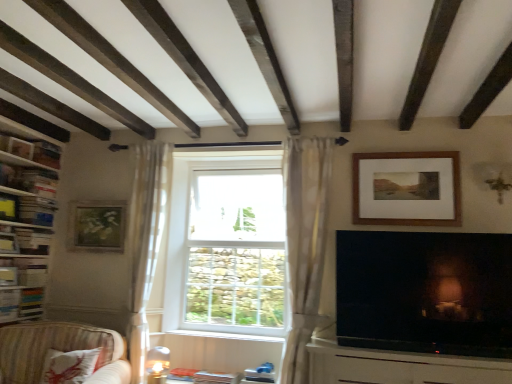
Locate an element on the screen. The width and height of the screenshot is (512, 384). white sheer curtain at left, the 2th curtain positioned from the right is located at coordinates (146, 241).

The height and width of the screenshot is (384, 512). What do you see at coordinates (97, 226) in the screenshot?
I see `matte gold picture frame at left, arranged as the second picture frame when viewed from the right` at bounding box center [97, 226].

What is the approximate width of white glass window at center?

The width of white glass window at center is 24.80 centimeters.

Describe the element at coordinates (26, 218) in the screenshot. I see `wooden bookshelf at left, acting as the 2th shelf starting from the bottom` at that location.

This screenshot has width=512, height=384. What are the coordinates of `white sheer curtain at left, the 2th curtain positioned from the right` in the screenshot? It's located at click(x=146, y=241).

Is wooden bookshelf at left, placed as the 1th shelf when sorted from bottom to top, facing away from wooden bookshelf at left, acting as the 2th shelf starting from the bottom?

Yes.

You are a GUI agent. You are given a task and a screenshot of the screen. Output one action in this format:
    pyautogui.click(x=<x>, y=<y>)
    Task: Click on the shelf to the right of wooden bookshelf at left, acting as the 2th shelf starting from the bottom
    
    Given the screenshot: What is the action you would take?
    pyautogui.click(x=24, y=240)

From their relative heights in the image, would you say wooden bookshelf at left, which is the 2th shelf from top to bottom, is taller or shorter than wooden bookshelf at left, acting as the 2th shelf starting from the bottom?

Clearly, wooden bookshelf at left, which is the 2th shelf from top to bottom, is shorter compared to wooden bookshelf at left, acting as the 2th shelf starting from the bottom.

Considering the positions of objects wooden bookshelf at left, placed as the 1th shelf when sorted from bottom to top, and wooden bookshelf at left, acting as the 2th shelf starting from the bottom, in the image provided, who is more to the left, wooden bookshelf at left, placed as the 1th shelf when sorted from bottom to top, or wooden bookshelf at left, acting as the 2th shelf starting from the bottom,?

From the viewer's perspective, wooden bookshelf at left, acting as the 2th shelf starting from the bottom, appears more on the left side.

Based on the photo, considering the sizes of objects white painted wood at center and matte gold picture frame at left, arranged as the second picture frame when viewed from the right, in the image provided, who is wider, white painted wood at center or matte gold picture frame at left, arranged as the second picture frame when viewed from the right,?

white painted wood at center is wider.

Where is `window sill that appears in front of the matte gold picture frame at left, the 1th picture frame viewed from the left`? window sill that appears in front of the matte gold picture frame at left, the 1th picture frame viewed from the left is located at coordinates (218, 336).

Is white painted wood at center next to matte gold picture frame at left, which is counted as the 2th picture frame, starting from the front?

They are not placed beside each other.

From the image's perspective, which is above, white painted wood at center or matte gold picture frame at left, the 1th picture frame viewed from the left?

matte gold picture frame at left, the 1th picture frame viewed from the left, is shown above in the image.

Which of these two, wooden bookshelf at left, the first shelf from the top, or white glass window at center, stands taller?

With more height is wooden bookshelf at left, the first shelf from the top.

Could you measure the distance between wooden bookshelf at left, acting as the 2th shelf starting from the bottom, and white glass window at center?

They are 4.49 feet apart.

What are the coordinates of `window directly beneath the wooden bookshelf at left, the first shelf from the top (from a real-world perspective)` in the screenshot? It's located at (226, 244).

From the picture: In terms of size, does wooden bookshelf at left, the first shelf from the top, appear bigger or smaller than white glass window at center?

In the image, wooden bookshelf at left, the first shelf from the top, appears to be larger than white glass window at center.

Between wooden bookshelf at left, placed as the 1th shelf when sorted from bottom to top, and matte black television at lower right, which one is positioned in front?

Positioned in front is matte black television at lower right.

Considering the relative sizes of wooden bookshelf at left, which is the 2th shelf from top to bottom, and matte black television at lower right in the image provided, is wooden bookshelf at left, which is the 2th shelf from top to bottom, thinner than matte black television at lower right?

In fact, wooden bookshelf at left, which is the 2th shelf from top to bottom, might be wider than matte black television at lower right.

Is wooden bookshelf at left, placed as the 1th shelf when sorted from bottom to top, looking in the opposite direction of matte black television at lower right?

No, wooden bookshelf at left, placed as the 1th shelf when sorted from bottom to top,'s orientation is not away from matte black television at lower right.

Where is `television directly beneath the wooden bookshelf at left, which is the 2th shelf from top to bottom (from a real-world perspective)`? television directly beneath the wooden bookshelf at left, which is the 2th shelf from top to bottom (from a real-world perspective) is located at coordinates (425, 292).

Is point (32, 232) less distant than point (318, 260)?

No, it is behind (318, 260).

Considering the sizes of wooden bookshelf at left, acting as the 2th shelf starting from the bottom, and sheer white curtain at center, positioned as the 2th curtain in left-to-right order, in the image, is wooden bookshelf at left, acting as the 2th shelf starting from the bottom, wider or thinner than sheer white curtain at center, positioned as the 2th curtain in left-to-right order,?

In the image, wooden bookshelf at left, acting as the 2th shelf starting from the bottom, appears to be wider than sheer white curtain at center, positioned as the 2th curtain in left-to-right order.

How different are the orientations of wooden bookshelf at left, the first shelf from the top, and sheer white curtain at center, which is the 1th curtain in right-to-left order, in degrees?

wooden bookshelf at left, the first shelf from the top, and sheer white curtain at center, which is the 1th curtain in right-to-left order, are facing 92.5 degrees away from each other.

From the picture: Could you tell me if sheer white curtain at center, which is the 1th curtain in right-to-left order, is facing matte black television at lower right?

Result: No, sheer white curtain at center, which is the 1th curtain in right-to-left order, is not aimed at matte black television at lower right.

From a real-world perspective, who is located higher, sheer white curtain at center, positioned as the 2th curtain in left-to-right order, or matte black television at lower right?

In real-world perspective, sheer white curtain at center, positioned as the 2th curtain in left-to-right order, is above.

Is matte black television at lower right surrounded by sheer white curtain at center, positioned as the 2th curtain in left-to-right order?

No.

Between sheer white curtain at center, which is the 1th curtain in right-to-left order, and matte black television at lower right, which one appears on the left side from the viewer's perspective?

sheer white curtain at center, which is the 1th curtain in right-to-left order, is more to the left.

How much distance is there between matte gold picture frame at left, the 1th picture frame viewed from the left, and white painted wood at center?

A distance of 1.03 meters exists between matte gold picture frame at left, the 1th picture frame viewed from the left, and white painted wood at center.

Between matte gold picture frame at left, which is counted as the 2th picture frame, starting from the front, and white painted wood at center, which one has less height?

white painted wood at center.

Is matte gold picture frame at left, arranged as the second picture frame when viewed from the right, closer to the viewer compared to white painted wood at center?

That is False.

From the image's perspective, is matte gold picture frame at left, arranged as the second picture frame when viewed from the right, located beneath white painted wood at center?

Actually, matte gold picture frame at left, arranged as the second picture frame when viewed from the right, appears above white painted wood at center in the image.

Image resolution: width=512 pixels, height=384 pixels. Find the location of `shelf on the right of wooden bookshelf at left, acting as the 2th shelf starting from the bottom`. shelf on the right of wooden bookshelf at left, acting as the 2th shelf starting from the bottom is located at coordinates (24, 240).

The image size is (512, 384). I want to click on window sill below the matte gold picture frame at left, the 1th picture frame viewed from the left (from a real-world perspective), so click(218, 336).

Considering their positions, is matte black television at lower right positioned closer to striped fabric couch at lower left than white painted wood at center?

white painted wood at center is positioned closer to the anchor striped fabric couch at lower left.

Which object lies nearer to the anchor point wooden bookshelf at left, the first shelf from the top, striped fabric couch at lower left or wooden bookshelf at left, which is the 2th shelf from top to bottom?

wooden bookshelf at left, which is the 2th shelf from top to bottom, is closer to wooden bookshelf at left, the first shelf from the top.

Looking at the image, which one is located further to matte gold picture frame at left, which appears as the first picture frame when viewed from the back, matte black television at lower right or white sheer curtain at left, the 2th curtain positioned from the right?

Among the two, matte black television at lower right is located further to matte gold picture frame at left, which appears as the first picture frame when viewed from the back.

Considering their positions, is sheer white curtain at center, positioned as the 2th curtain in left-to-right order, positioned closer to white painted wood at center than striped fabric couch at lower left?

The object closer to white painted wood at center is striped fabric couch at lower left.

Which object lies further to the anchor point matte black television at lower right, striped fabric couch at lower left or matte gold picture frame at left, which appears as the first picture frame when viewed from the back?

matte gold picture frame at left, which appears as the first picture frame when viewed from the back, is further to matte black television at lower right.

From the image, which object appears to be farther from white sheer curtain at left, the 2th curtain positioned from the right, sheer white curtain at center, positioned as the 2th curtain in left-to-right order, or matte black television at lower right?

matte black television at lower right is further to white sheer curtain at left, the 2th curtain positioned from the right.

Which object lies further to the anchor point wooden bookshelf at left, acting as the 2th shelf starting from the bottom, white glass window at center or striped fabric couch at lower left?

Among the two, white glass window at center is located further to wooden bookshelf at left, acting as the 2th shelf starting from the bottom.

Considering their positions, is white glass window at center positioned closer to white painted wood at center than striped fabric couch at lower left?

The object closer to white painted wood at center is white glass window at center.

Locate an element on the screen. picture frame between wooden bookshelf at left, the first shelf from the top, and white sheer curtain at left, acting as the 1th curtain starting from the left, from left to right is located at coordinates (97, 226).

Where is `window located between matte gold picture frame at left, arranged as the second picture frame when viewed from the right, and sheer white curtain at center, positioned as the 2th curtain in left-to-right order, in the left-right direction`? The image size is (512, 384). window located between matte gold picture frame at left, arranged as the second picture frame when viewed from the right, and sheer white curtain at center, positioned as the 2th curtain in left-to-right order, in the left-right direction is located at coordinates [x=226, y=244].

Where is `picture frame between striped fabric couch at lower left and wooden frame at upper right, which appears as the 1th picture frame when viewed from the right`? The image size is (512, 384). picture frame between striped fabric couch at lower left and wooden frame at upper right, which appears as the 1th picture frame when viewed from the right is located at coordinates (97, 226).

You are a GUI agent. You are given a task and a screenshot of the screen. Output one action in this format:
    pyautogui.click(x=<x>, y=<y>)
    Task: Click on the studio couch located between wooden bookshelf at left, placed as the 1th shelf when sorted from bottom to top, and wooden frame at upper right, arranged as the second picture frame when viewed from the back, in the left-right direction
    The height and width of the screenshot is (384, 512).
    Given the screenshot: What is the action you would take?
    pyautogui.click(x=59, y=350)